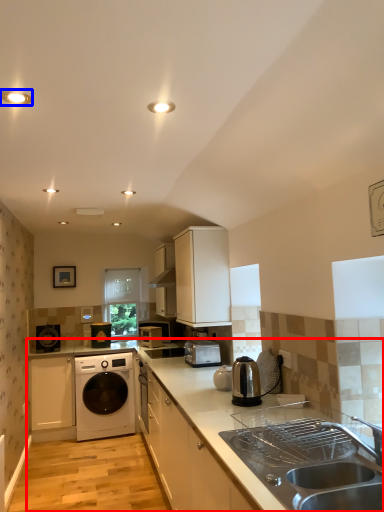
Question: Which object is closer to the camera taking this photo, countertop (highlighted by a red box) or lighting (highlighted by a blue box)?

Choices:
 (A) countertop
 (B) lighting

Answer: (A)